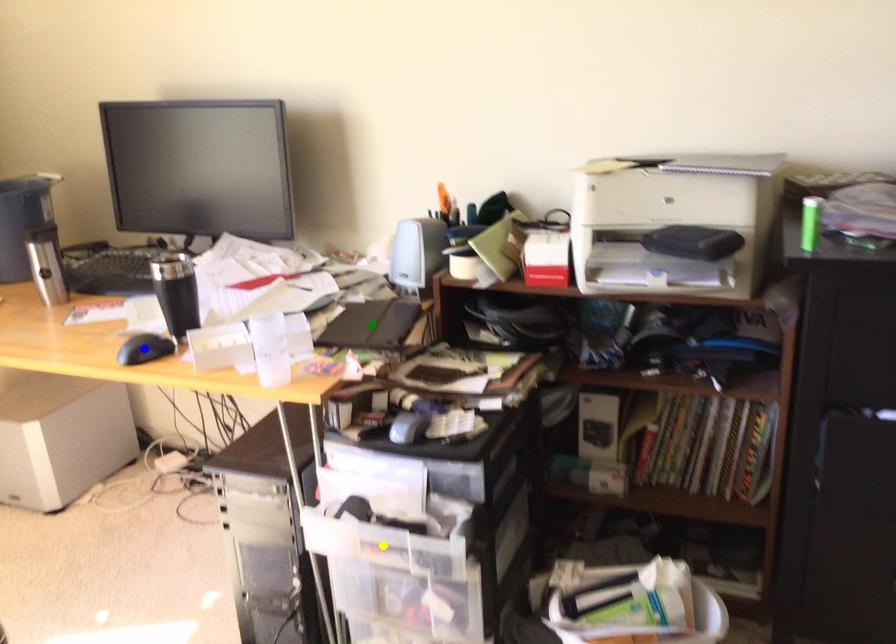
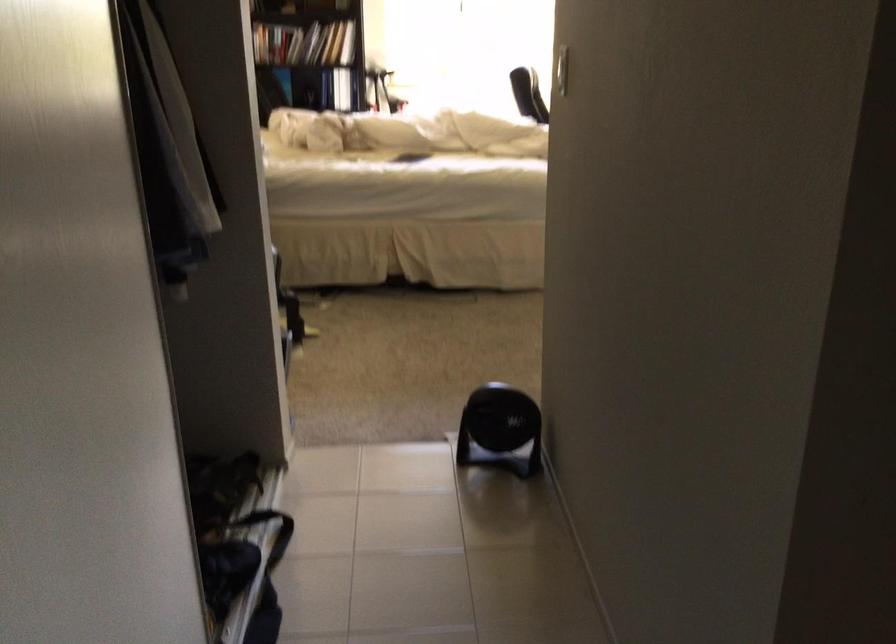
I am providing you with two images of the same scene from different viewpoints. Three points are marked in image1. Which point corresponds to a part or object that is occluded in image2?In image1, three points are marked. Which of them correspond to a part or object that is occluded in image2?Among the three points shown in image1, which one corresponds to a part or object that is no longer visible due to occlusion in image2?

yellow point, green point, blue point cannot be seen in image2.